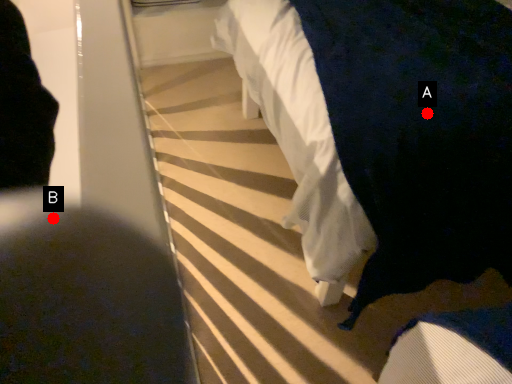
Question: Two points are circled on the image, labeled by A and B beside each circle. Among these points, which one is nearest to the camera?

Choices:
 (A) A is closer
 (B) B is closer

Answer: (A)